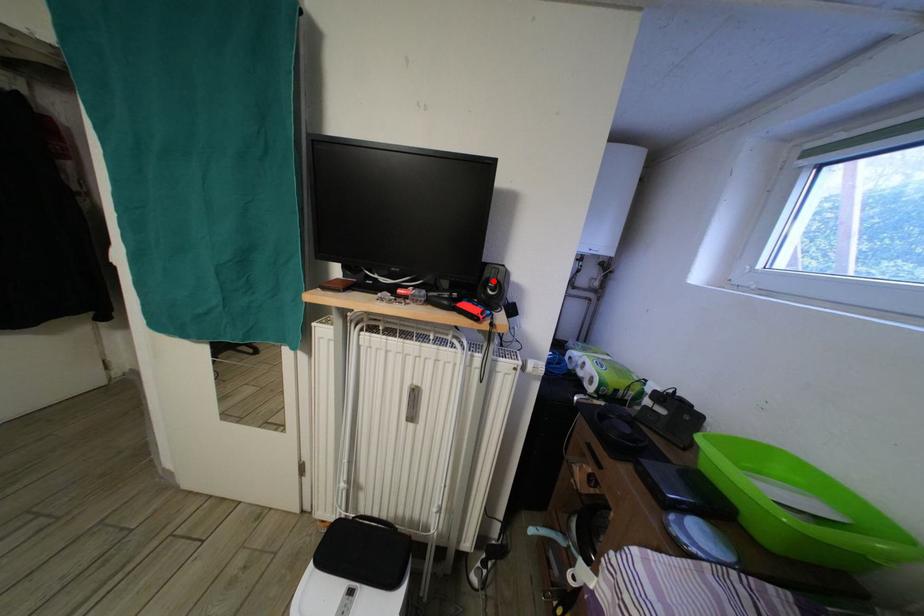
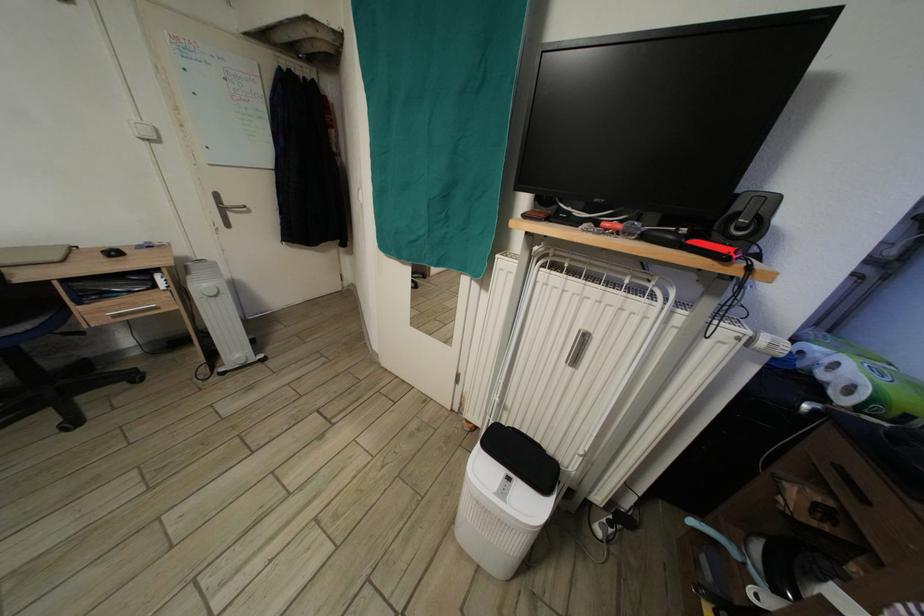
The point at the highlighted location is marked in the first image. Where is the corresponding point in the second image?

(744, 214)